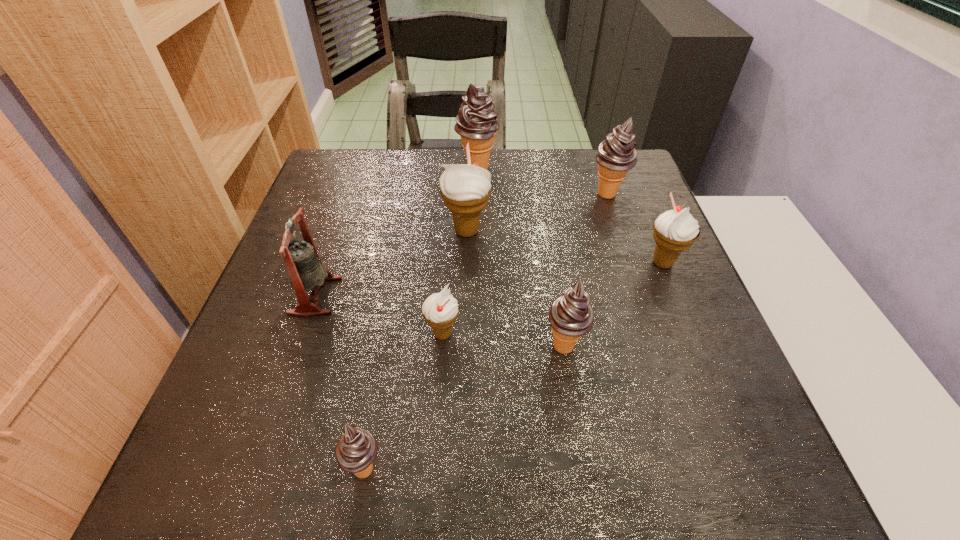
Where is `vacant region located 0.060m on the front of the nearest white icecream`? Image resolution: width=960 pixels, height=540 pixels. vacant region located 0.060m on the front of the nearest white icecream is located at coordinates (440, 377).

At what (x,y) coordinates should I click in order to perform the action: click on vacant space situated on the back of the leftmost icecream. Please return your answer as a coordinate pair (x, y). This screenshot has height=540, width=960. Looking at the image, I should click on (381, 377).

You are a GUI agent. You are given a task and a screenshot of the screen. Output one action in this format:
    pyautogui.click(x=<x>, y=<y>)
    Task: Click on the object situated at the near edge
    Image resolution: width=960 pixels, height=540 pixels.
    Given the screenshot: What is the action you would take?
    pyautogui.click(x=356, y=450)

The width and height of the screenshot is (960, 540). I want to click on object that is at the left edge, so click(301, 258).

Where is `object that is at the far right corner`? The height and width of the screenshot is (540, 960). object that is at the far right corner is located at coordinates (617, 154).

The image size is (960, 540). What are the coordinates of `free space at the far edge of the desktop` in the screenshot? It's located at (575, 179).

Image resolution: width=960 pixels, height=540 pixels. Find the location of `free point at the near edge`. free point at the near edge is located at coordinates (591, 450).

This screenshot has width=960, height=540. What are the coordinates of `vacant region at the left edge of the desktop` in the screenshot? It's located at (221, 438).

This screenshot has width=960, height=540. Find the location of `free space at the right edge of the desktop`. free space at the right edge of the desktop is located at coordinates (666, 347).

You are a GUI agent. You are given a task and a screenshot of the screen. Output one action in this format:
    pyautogui.click(x=<x>, y=<y>)
    Task: Click on the vacant space that is in between the third farthest chocolate icecream and the leftmost icecream
    
    Given the screenshot: What is the action you would take?
    pyautogui.click(x=465, y=407)